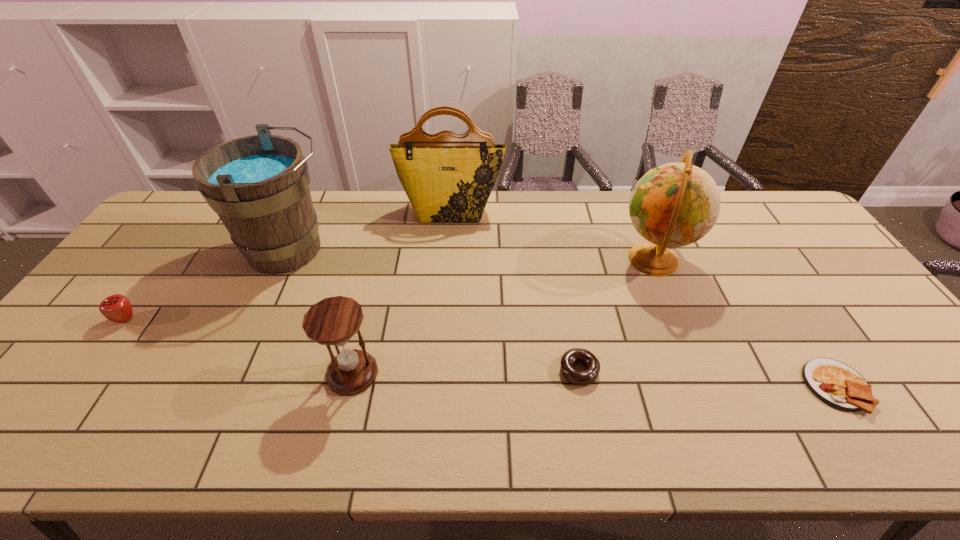
At what (x,y) coordinates should I click in order to perform the action: click on free space located 0.380m on the front-facing side of the tote bag. Please return your answer as a coordinate pair (x, y). The width and height of the screenshot is (960, 540). Looking at the image, I should click on (444, 309).

This screenshot has width=960, height=540. In order to click on free spot located 0.320m on the left of the globe in this screenshot , I will do `click(510, 260)`.

At what (x,y) coordinates should I click in order to perform the action: click on free location located with a handle on the side of the wine bucket. Please return your answer as a coordinate pair (x, y). This screenshot has height=540, width=960. Looking at the image, I should click on (393, 250).

Where is `vacant space located on the back of the hourglass`? vacant space located on the back of the hourglass is located at coordinates (373, 284).

Find the location of a particular element. This screenshot has height=540, width=960. free space located on the back of the leftmost object is located at coordinates (180, 246).

Find the location of a particular element. The width and height of the screenshot is (960, 540). free space located on the right of the second shortest object is located at coordinates (681, 370).

The image size is (960, 540). I want to click on free region located on the right of the rightmost object, so click(x=926, y=387).

This screenshot has width=960, height=540. In order to click on tote bag at the far edge in this screenshot , I will do `click(448, 178)`.

You are a GUI agent. You are given a task and a screenshot of the screen. Output one action in this format:
    pyautogui.click(x=<x>, y=<y>)
    Task: Click on the globe located at the far edge
    This screenshot has width=960, height=540.
    Given the screenshot: What is the action you would take?
    pyautogui.click(x=673, y=205)

I want to click on wine bucket at the far edge, so click(x=258, y=185).